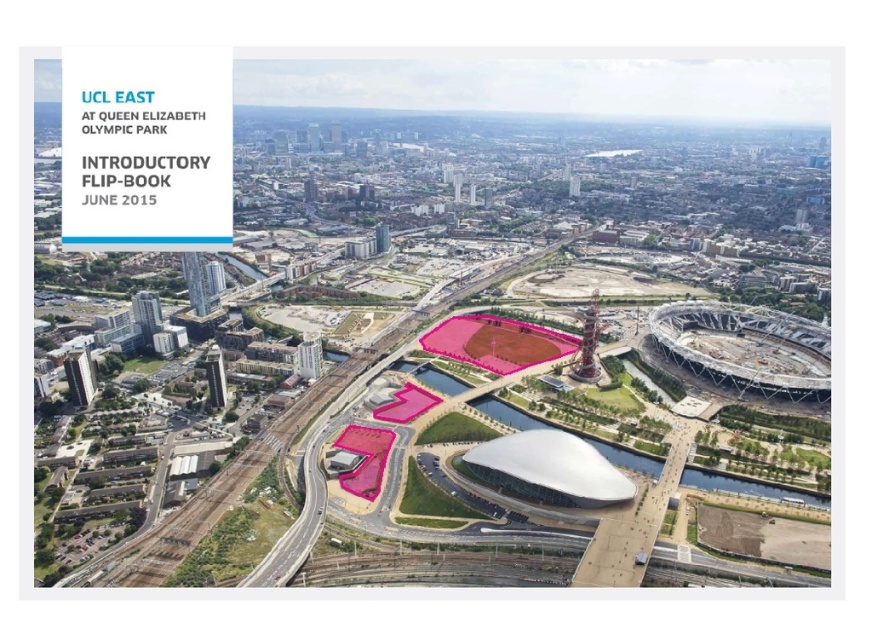
Question: Observing the image, what is the correct spatial positioning of white smooth stadium at center in reference to pink matte football field at center?

Choices:
 (A) left
 (B) right

Answer: (B)

Question: Which object is closer to the camera taking this photo?

Choices:
 (A) white smooth stadium at center
 (B) pink matte football field at center

Answer: (A)

Question: Which point is closer to the camera?

Choices:
 (A) white smooth stadium at center
 (B) pink matte football field at center

Answer: (A)

Question: Which point appears farthest from the camera in this image?

Choices:
 (A) (477, 392)
 (B) (501, 340)

Answer: (B)

Question: Considering the relative positions of white smooth stadium at center and pink matte football field at center in the image provided, where is white smooth stadium at center located with respect to pink matte football field at center?

Choices:
 (A) above
 (B) below

Answer: (A)

Question: Is white smooth stadium at center to the right of pink matte football field at center from the viewer's perspective?

Choices:
 (A) no
 (B) yes

Answer: (B)